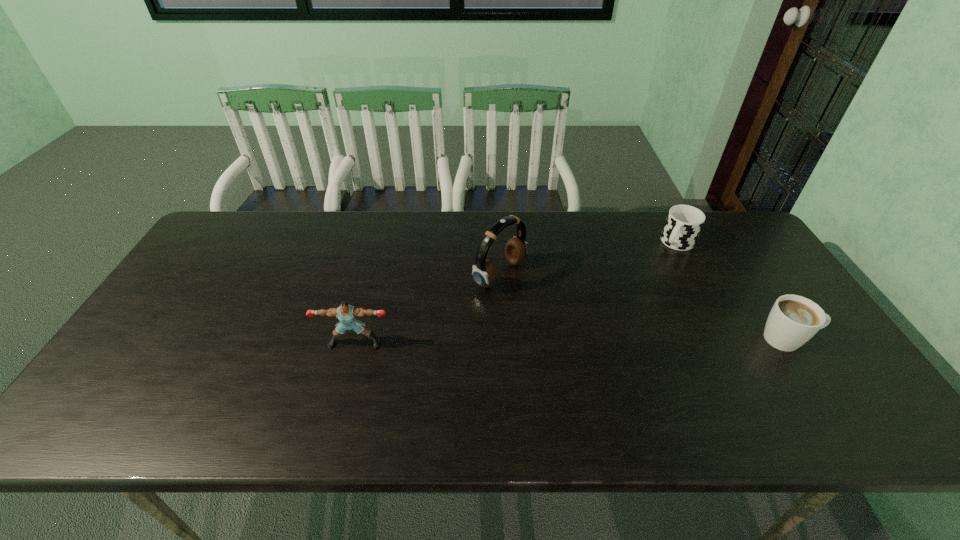
This screenshot has height=540, width=960. I want to click on unoccupied area between the leftmost object and the third object from left to right, so click(x=516, y=293).

This screenshot has width=960, height=540. Identify the location of free point between the third nearest object and the farthest object. (588, 259).

You are a GUI agent. You are given a task and a screenshot of the screen. Output one action in this format:
    pyautogui.click(x=<x>, y=<y>)
    Task: Click on the closest object relative to the puncher
    
    Given the screenshot: What is the action you would take?
    pyautogui.click(x=484, y=274)

Identify which object is located as the nearest to the tallest object. Please provide its 2D coordinates. Your answer should be formatted as a tuple, i.e. [(x, y)], where the tuple contains the x and y coordinates of a point satisfying the conditions above.

[(346, 314)]

Where is `free location that satisfies the following two spatial constraints: 1. on the front side of the cappuccino; 2. with the handle on the side of the farthest object`? free location that satisfies the following two spatial constraints: 1. on the front side of the cappuccino; 2. with the handle on the side of the farthest object is located at coordinates (727, 339).

This screenshot has width=960, height=540. Identify the location of free space that satisfies the following two spatial constraints: 1. on the front side of the tallest object; 2. with the handle on the side of the rightmost object. (503, 339).

Locate an element on the screen. Image resolution: width=960 pixels, height=540 pixels. vacant space that satisfies the following two spatial constraints: 1. on the front side of the rightmost object; 2. with the handle on the side of the third nearest object is located at coordinates (503, 339).

Find the location of `vacant position in the image that satisfies the following two spatial constraints: 1. on the front side of the third object from right to left; 2. with the handle on the side of the rightmost object`. vacant position in the image that satisfies the following two spatial constraints: 1. on the front side of the third object from right to left; 2. with the handle on the side of the rightmost object is located at coordinates coord(503,339).